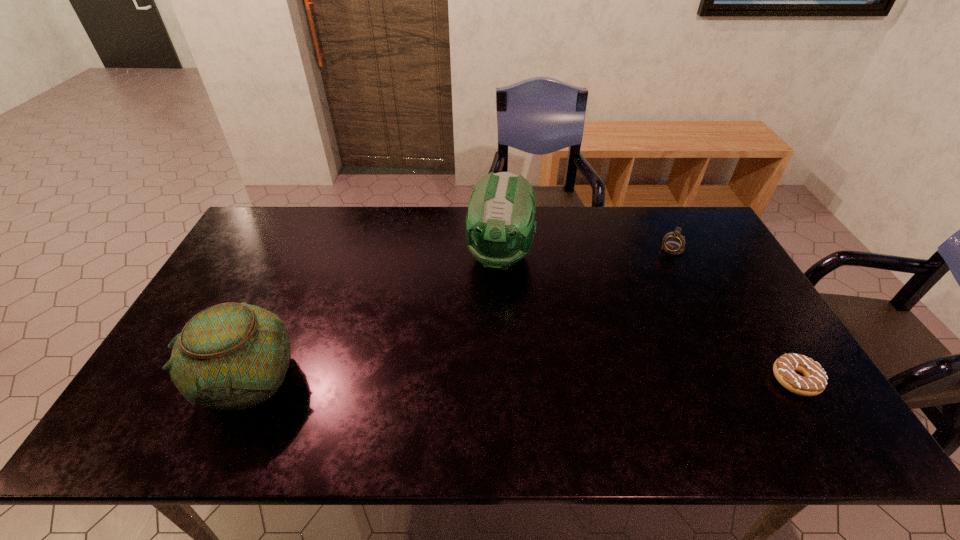
This screenshot has height=540, width=960. In order to click on free space between the pottery and the shortest object in this screenshot , I will do `click(521, 379)`.

You are a GUI agent. You are given a task and a screenshot of the screen. Output one action in this format:
    pyautogui.click(x=<x>, y=<y>)
    Task: Click on the object that is the third closest one to the rightmost object
    The width and height of the screenshot is (960, 540).
    Given the screenshot: What is the action you would take?
    pyautogui.click(x=231, y=356)

Identify which object is located as the second nearest to the third object from right to left. Please provide its 2D coordinates. Your answer should be formatted as a tuple, i.e. [(x, y)], where the tuple contains the x and y coordinates of a point satisfying the conditions above.

[(231, 356)]

Identify the location of vacant position in the image that satisfies the following two spatial constraints: 1. on the front side of the compass; 2. on the right side of the rightmost object. Image resolution: width=960 pixels, height=540 pixels. (737, 380).

The image size is (960, 540). In order to click on vacant space that satisfies the following two spatial constraints: 1. on the front side of the doughnut; 2. on the left side of the third tallest object in this screenshot , I will do `click(737, 380)`.

Image resolution: width=960 pixels, height=540 pixels. What are the coordinates of `free space that satisfies the following two spatial constraints: 1. on the front side of the second object from right to left; 2. on the right side of the doughnut` in the screenshot? It's located at (737, 380).